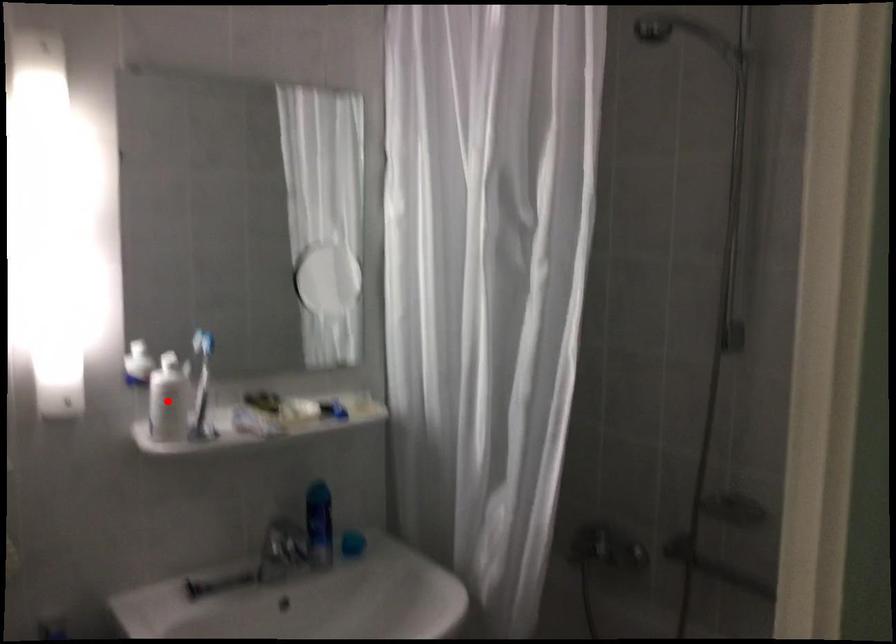
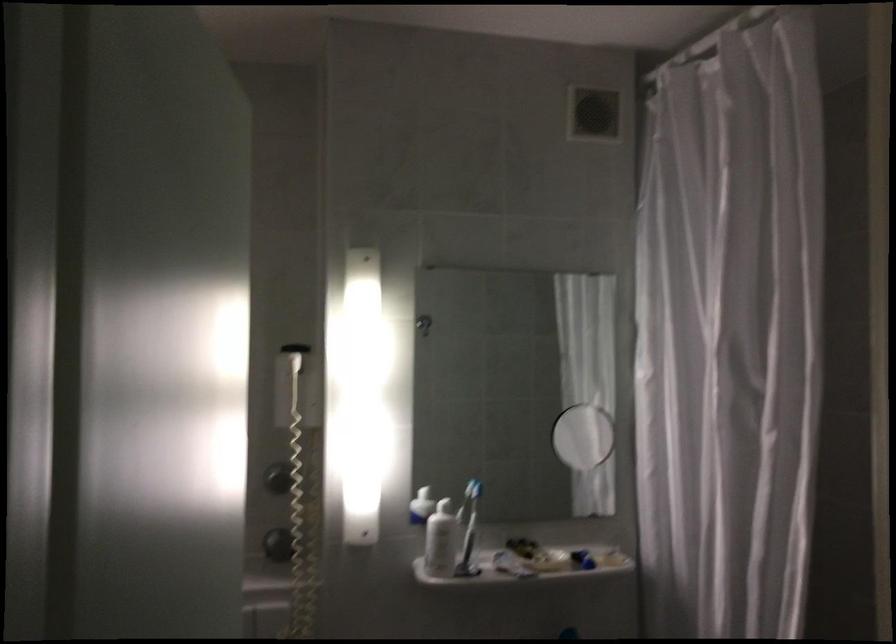
Question: I am providing you with two images of the same scene from different viewpoints. Image1 has a red point marked. In image2, the corresponding 3D location appears at what relative position? Reply with the corresponding letter.

Choices:
 (A) Closer
 (B) Farther

Answer: (B)